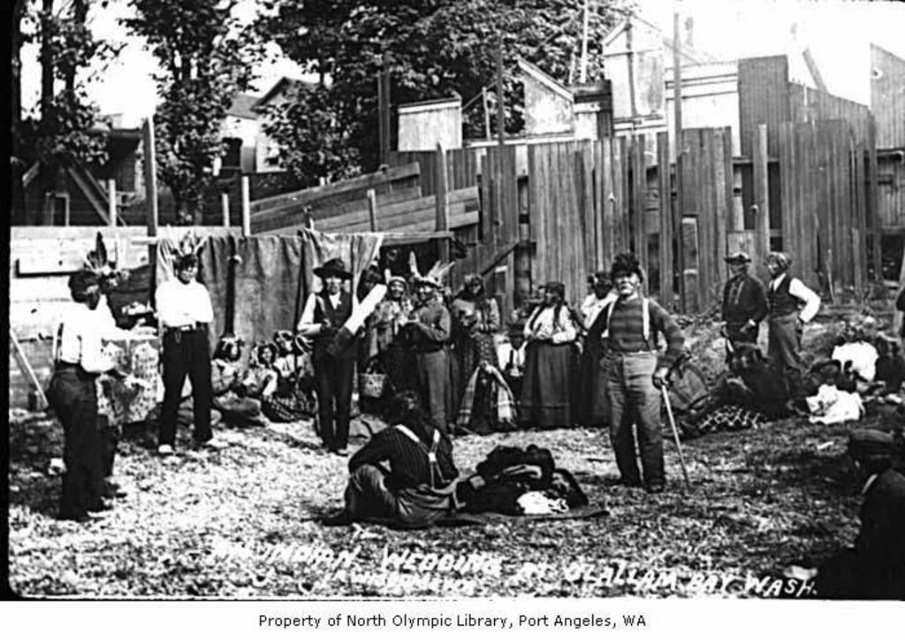
You are a photographer reviewing this black and white image. You need to locate the white cotton shirt at center. Where exactly is it positioned in the image?

The white cotton shirt at center is located at point (184, 353).

You are a photographer who wants to capture a clear image of the dark brown leather hat at lower right without the white cotton shirt at center blocking it. What adjustment should you make to your camera angle?

The dark brown leather hat at lower right is positioned under the white cotton shirt at center, so to avoid blocking, you should angle the camera upwards to look up towards the hat while moving the camera lower to avoid the shirt.